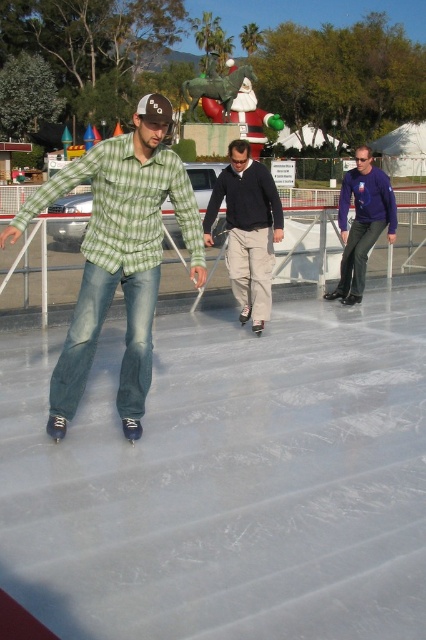
Question: Is green plaid shirt at center further to camera compared to matte purple sweater at center?

Choices:
 (A) yes
 (B) no

Answer: (B)

Question: Can you confirm if dark blue sweater at center is smaller than matte purple sweater at center?

Choices:
 (A) no
 (B) yes

Answer: (A)

Question: Estimate the real-world distances between objects in this image. Which object is farther from the dark blue sweater at center?

Choices:
 (A) matte purple sweater at center
 (B) green plaid shirt at center

Answer: (B)

Question: Does dark blue sweater at center have a larger size compared to matte purple sweater at center?

Choices:
 (A) no
 (B) yes

Answer: (B)

Question: Which point is closer to the camera?

Choices:
 (A) (140, 166)
 (B) (347, 250)
 (C) (209, 216)

Answer: (A)

Question: Which point is closer to the camera?

Choices:
 (A) matte purple sweater at center
 (B) green plaid shirt at center

Answer: (B)